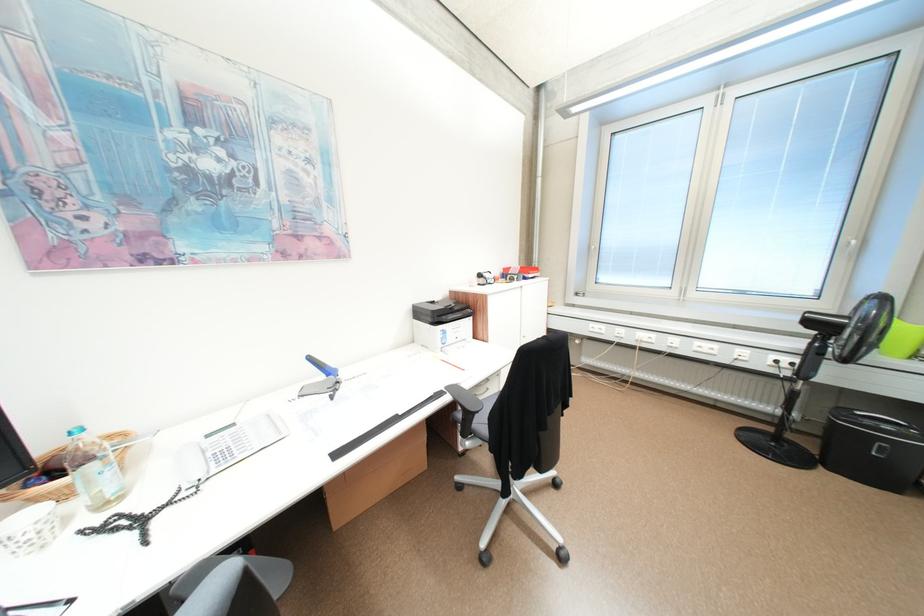
What do you see at coordinates (464, 398) in the screenshot? I see `the black chair armrest` at bounding box center [464, 398].